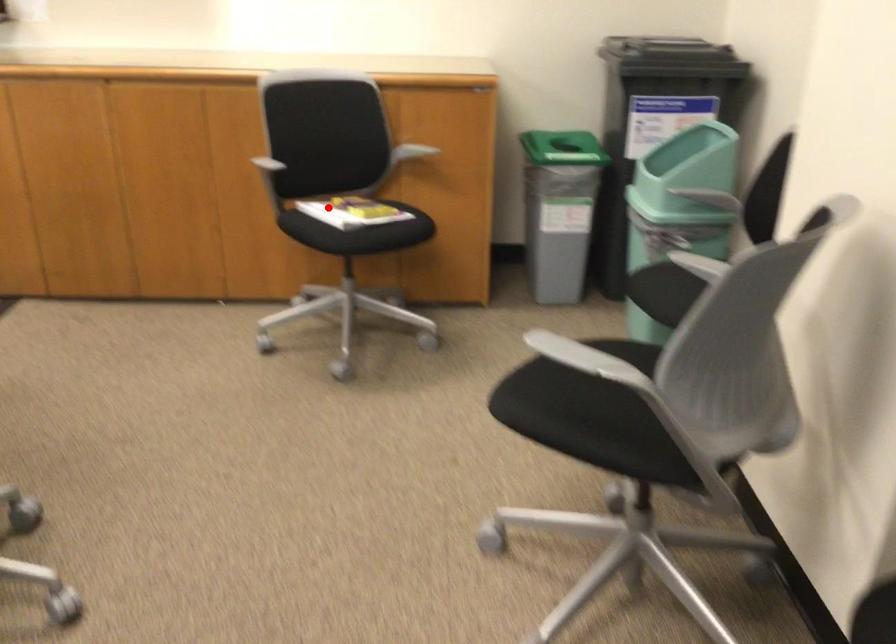
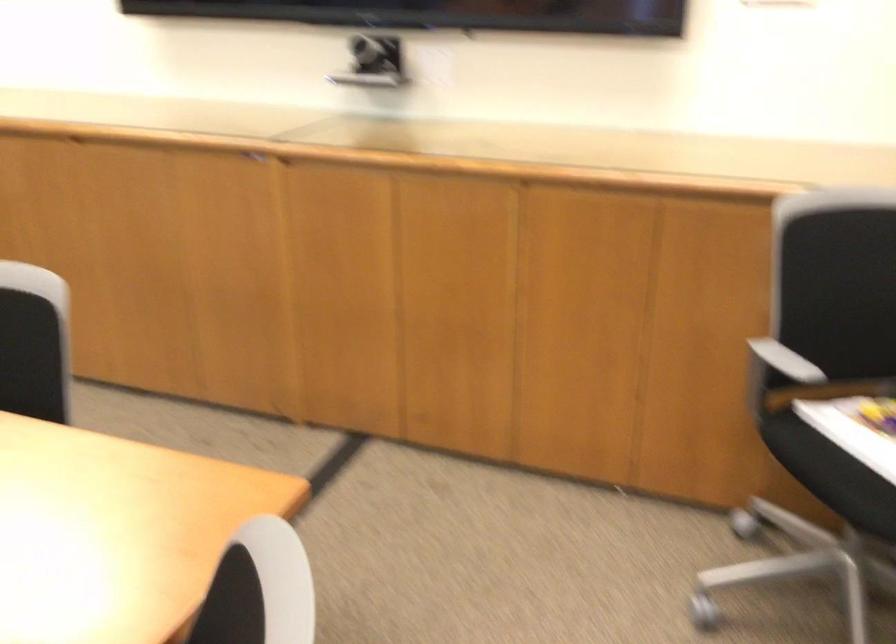
Question: I am providing you with two images of the same scene from different viewpoints. Given a red point in image1, look at the same physical point in image2. Is it:

Choices:
 (A) Closer to the viewpoint
 (B) Farther from the viewpoint

Answer: (A)